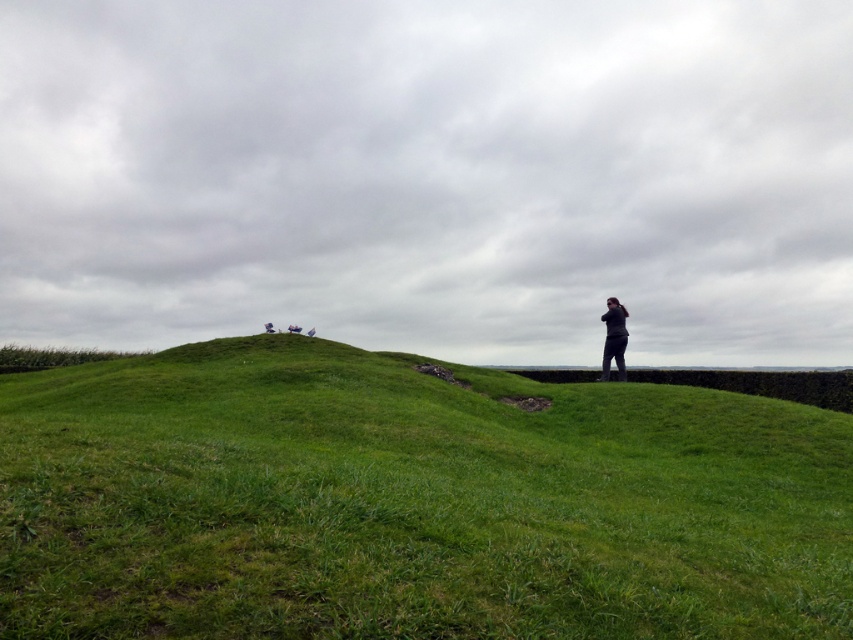
Question: Can you confirm if green grassy hillside at center is bigger than dark gray fabric person at right?

Choices:
 (A) no
 (B) yes

Answer: (B)

Question: In this image, where is green grassy hillside at center located relative to dark gray fabric person at right?

Choices:
 (A) below
 (B) above

Answer: (A)

Question: Among these points, which one is nearest to the camera?

Choices:
 (A) (612, 339)
 (B) (659, 586)

Answer: (B)

Question: Which of the following is the closest to the observer?

Choices:
 (A) green grassy hillside at center
 (B) dark gray fabric person at right

Answer: (A)

Question: Observing the image, what is the correct spatial positioning of green grassy hillside at center in reference to dark gray fabric person at right?

Choices:
 (A) below
 (B) above

Answer: (A)